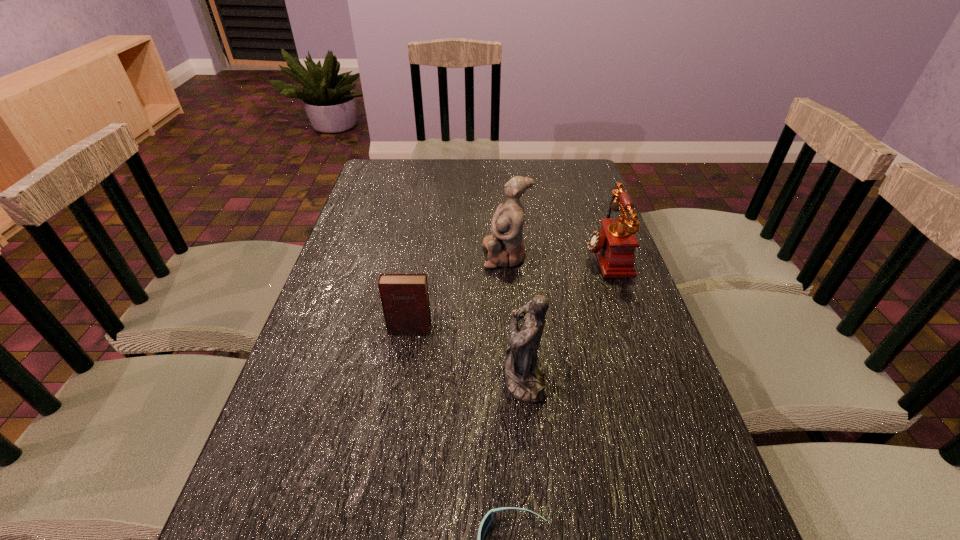
The width and height of the screenshot is (960, 540). I want to click on the farther figurine, so click(505, 246).

Find the location of a particular element. the nearer figurine is located at coordinates (524, 370).

At what (x,y) coordinates should I click in order to perform the action: click on the rightmost object. Please return your answer as a coordinate pair (x, y). The width and height of the screenshot is (960, 540). Looking at the image, I should click on (614, 244).

Find the location of `the third shortest object`. the third shortest object is located at coordinates (614, 244).

In order to click on diary in this screenshot , I will do `click(405, 300)`.

At what (x,y) coordinates should I click in order to perform the action: click on the third farthest object. Please return your answer as a coordinate pair (x, y). Image resolution: width=960 pixels, height=540 pixels. Looking at the image, I should click on (405, 300).

Find the location of a particular element. vacant space located on the front-facing side of the farther figurine is located at coordinates (398, 255).

This screenshot has width=960, height=540. In order to click on vacant space located 0.150m on the front-facing side of the farther figurine in this screenshot , I will do `click(430, 255)`.

Where is `vacant point located on the front-facing side of the farther figurine`? This screenshot has width=960, height=540. vacant point located on the front-facing side of the farther figurine is located at coordinates (444, 255).

At what (x,y) coordinates should I click in order to perform the action: click on free location located on the front-facing side of the fourth farthest object. Please return your answer as a coordinate pair (x, y). Looking at the image, I should click on (457, 377).